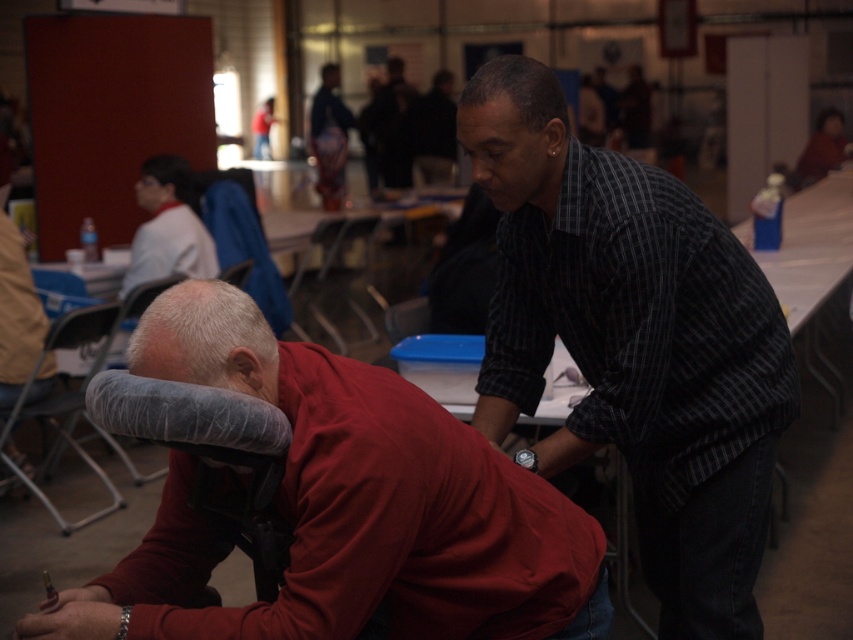
Where is the matte red shirt at center located in the image?

The matte red shirt at center is located at point (345, 506) in the image.

You are setting up chairs for an event in the described space. You need to place a new chair between the gray fabric folding chair at lower left and the light gray fabric chair at upper left. Can you fit it there without overlapping them?

The gray fabric folding chair at lower left is positioned under the light gray fabric chair at upper left, meaning they are stacked or arranged vertically. Since they are not side by side, there is no space between them to place a new chair without overlapping.

You are a photographer setting up for an event. You need to position a camera tripod between the gray fabric folding chair at lower left and the light gray fabric chair at upper left. Can you place the tripod between them without moving either chair?

The gray fabric folding chair at lower left is in front of the light gray fabric chair at upper left, so there is space between them. You can place the tripod between them without moving either chair.